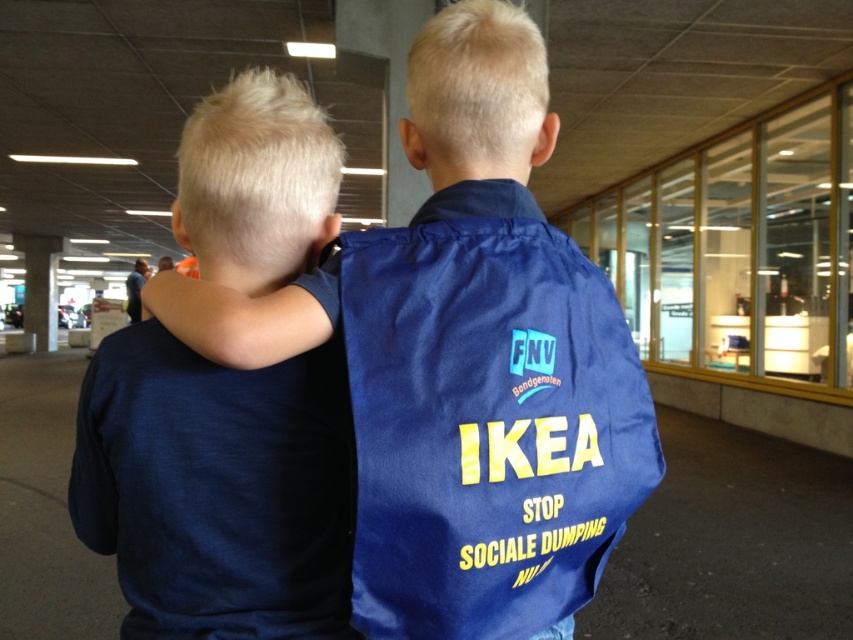
Which is below, blue fabric bag at center or dark blue t-shirt at center?

Positioned lower is blue fabric bag at center.

Is blue fabric bag at center positioned behind dark blue t-shirt at center?

That is False.

Is point (474, 372) more distant than point (148, 326)?

That is False.

At what (x,y) coordinates should I click in order to perform the action: click on blue fabric bag at center. Please return your answer as a coordinate pair (x, y). This screenshot has height=640, width=853. Looking at the image, I should click on (485, 417).

Can you confirm if navy blue shirt at center is smaller than blue fabric bag at center?

No, navy blue shirt at center is not smaller than blue fabric bag at center.

Which is in front, point (532, 321) or point (486, 392)?

Point (486, 392) is in front.

Find the location of a particular element. navy blue shirt at center is located at coordinates (463, 360).

Where is `navy blue shirt at center`? navy blue shirt at center is located at coordinates (463, 360).

Is blue fabric bag at center further to camera compared to smooth concrete pillar at center?

No, it is in front of smooth concrete pillar at center.

Who is more forward, (524, 236) or (41, 234)?

Point (524, 236) is in front.

I want to click on blue fabric bag at center, so click(485, 417).